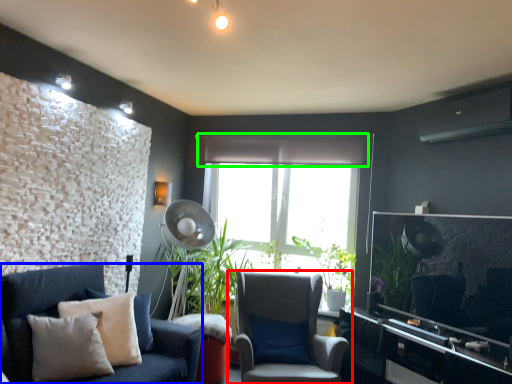
Question: Estimate the real-world distances between objects in this image. Which object is closer to chair (highlighted by a red box), studio couch (highlighted by a blue box) or curtain (highlighted by a green box)?

Choices:
 (A) studio couch
 (B) curtain

Answer: (A)